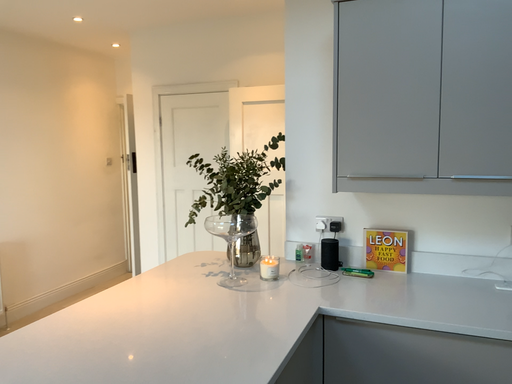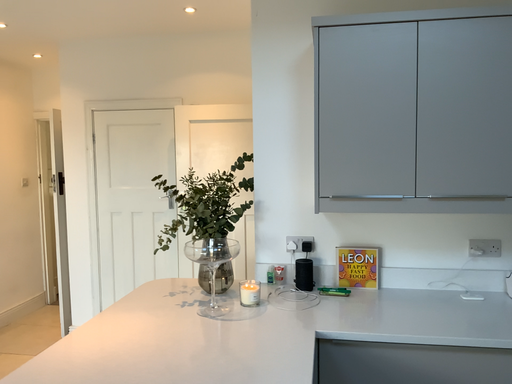
Question: Which way did the camera rotate in the video?

Choices:
 (A) rotated right
 (B) rotated left

Answer: (A)